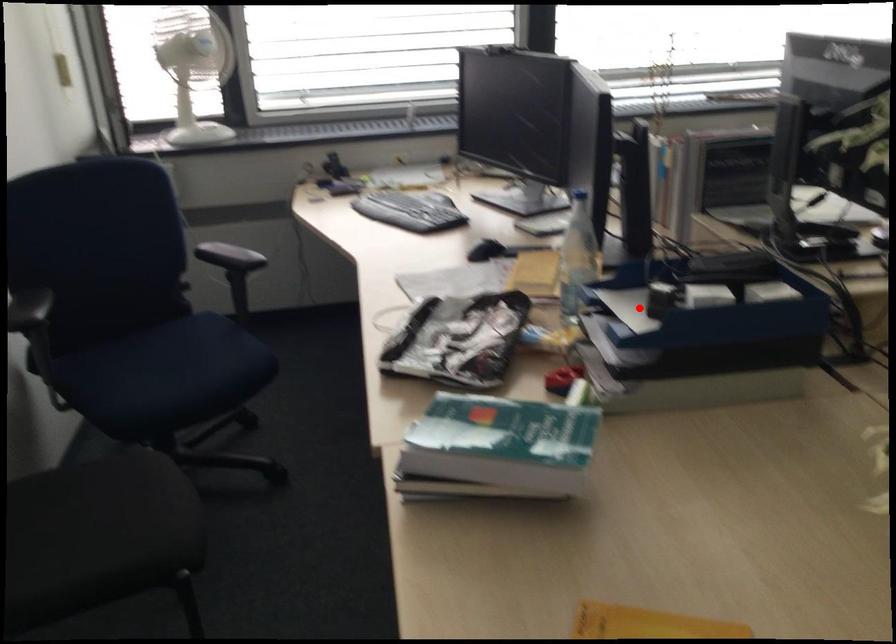
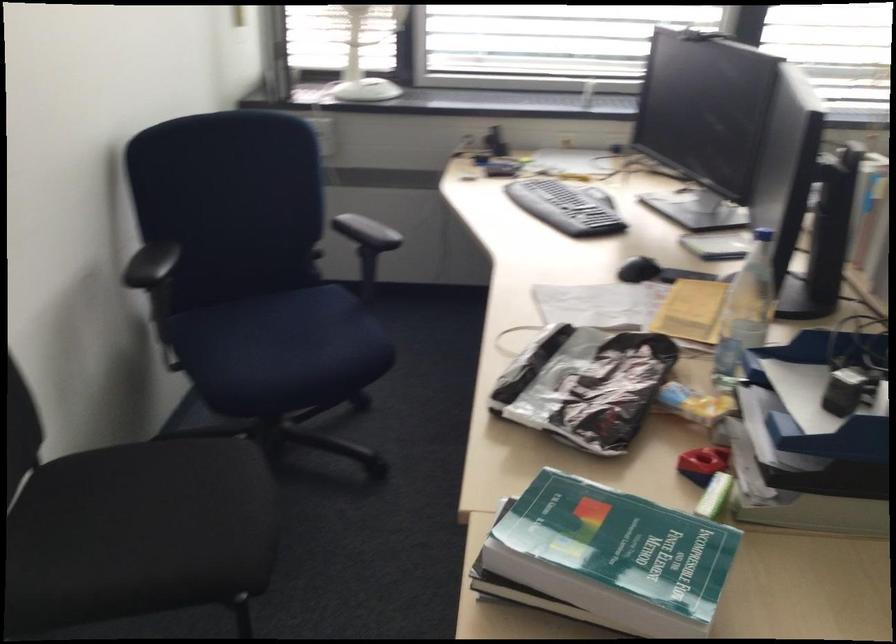
Question: I am providing you with two images of the same scene from different viewpoints. A red point is shown in image1. For the corresponding object point in image2, is it positioned nearer or farther from the camera?

Choices:
 (A) Nearer
 (B) Farther

Answer: (A)